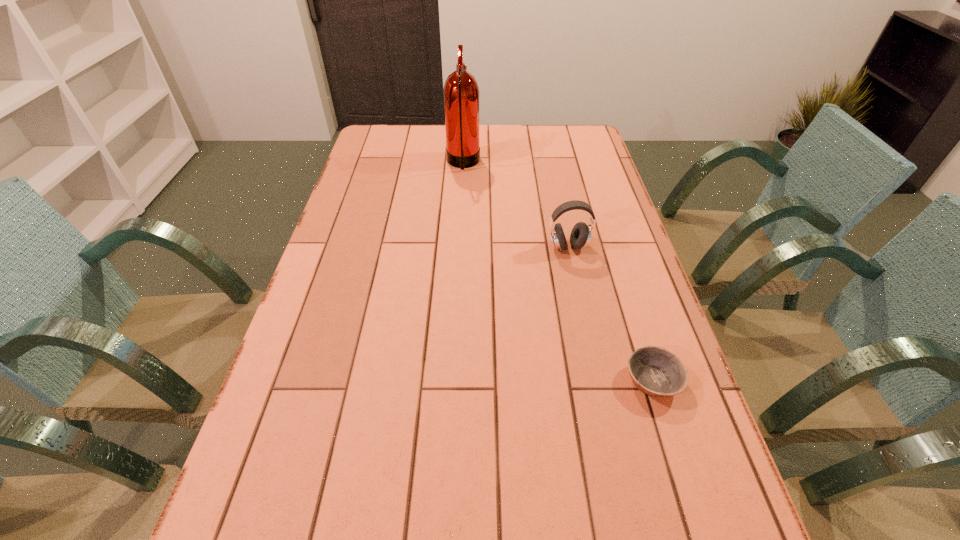
Locate an element on the screen. the farthest object is located at coordinates (461, 92).

Where is `the leftmost object`? This screenshot has height=540, width=960. the leftmost object is located at coordinates (461, 92).

Identify the location of the second nearest object. (580, 236).

Find the location of a particular element. The height and width of the screenshot is (540, 960). headset is located at coordinates (580, 236).

This screenshot has height=540, width=960. What are the coordinates of `the shortest object` in the screenshot? It's located at (655, 371).

This screenshot has height=540, width=960. I want to click on the nearest object, so click(655, 371).

I want to click on free location located on the front-facing side of the farthest object, so coord(575,163).

Where is `free space located 0.190m on the ear cups of the headset`? The height and width of the screenshot is (540, 960). free space located 0.190m on the ear cups of the headset is located at coordinates (581, 307).

Find the location of a particular element. Image resolution: width=960 pixels, height=540 pixels. blank space located on the back of the shortest object is located at coordinates (609, 241).

Where is `object that is at the far edge`? object that is at the far edge is located at coordinates (461, 92).